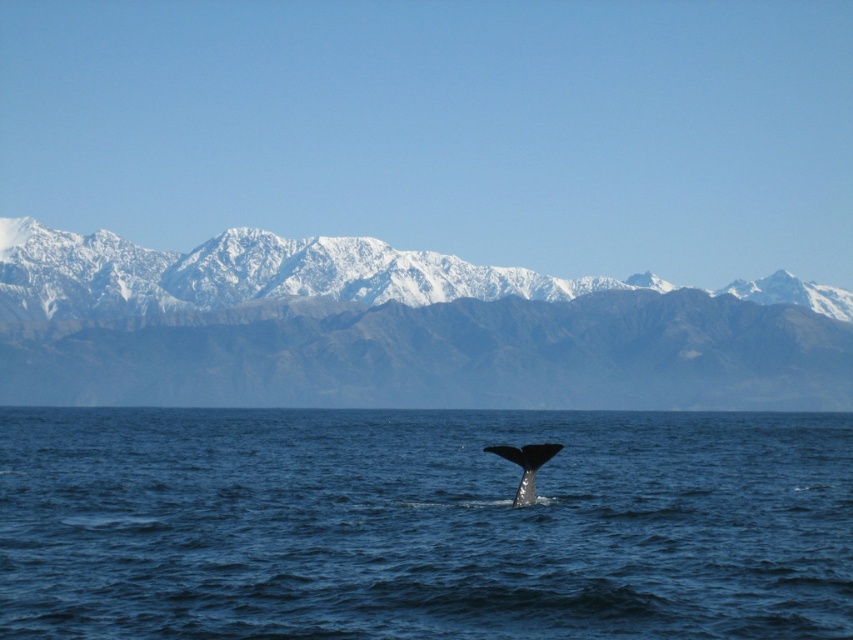
Question: Which of the following is the closest to the observer?

Choices:
 (A) (666, 468)
 (B) (831, 292)

Answer: (A)

Question: Is blue water at tail center to the right of gray smooth whale tail at lower center from the viewer's perspective?

Choices:
 (A) yes
 (B) no

Answer: (A)

Question: Does snowy rock mountain range at upper center appear on the right side of gray smooth whale tail at lower center?

Choices:
 (A) no
 (B) yes

Answer: (A)

Question: Which object is farther from the camera taking this photo?

Choices:
 (A) blue water at tail center
 (B) snowy rock mountain range at upper center
 (C) white snow-covered mountains at upper center

Answer: (C)

Question: Which point is farther to the camera?

Choices:
 (A) (650, 368)
 (B) (762, 506)
 (C) (527, 458)

Answer: (A)

Question: Is white snow-covered mountains at upper center above gray smooth whale tail at lower center?

Choices:
 (A) yes
 (B) no

Answer: (A)